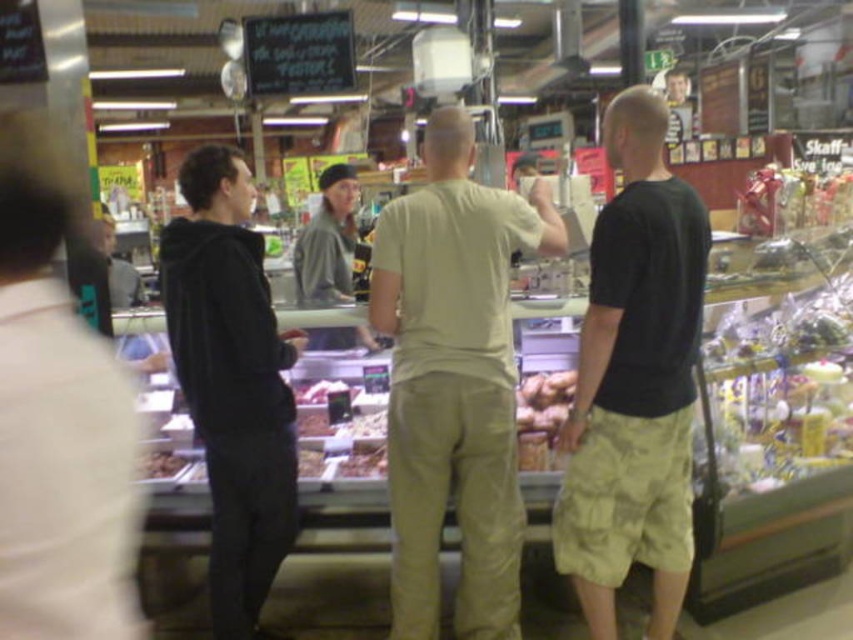
Question: Estimate the real-world distances between objects in this image. Which object is farther from the black matte hoodie at left?

Choices:
 (A) black cotton t-shirt at center
 (B) brown textured meat at center

Answer: (A)

Question: Considering the relative positions of black matte hoodie at left and golden brown bread at center in the image provided, where is black matte hoodie at left located with respect to golden brown bread at center?

Choices:
 (A) below
 (B) above

Answer: (B)

Question: Which object is positioned closest to the brown textured meat at center?

Choices:
 (A) light beige cotton t-shirt at center
 (B) black cotton t-shirt at center
 (C) gray fabric jacket at center

Answer: (C)

Question: Considering the relative positions of black cotton t-shirt at center and black matte hoodie at left in the image provided, where is black cotton t-shirt at center located with respect to black matte hoodie at left?

Choices:
 (A) left
 (B) right

Answer: (B)

Question: Is black matte hoodie at left bigger than brown textured meat at center?

Choices:
 (A) yes
 (B) no

Answer: (A)

Question: Which point is closer to the camera?

Choices:
 (A) (322, 195)
 (B) (672, 211)
 (C) (540, 388)

Answer: (B)